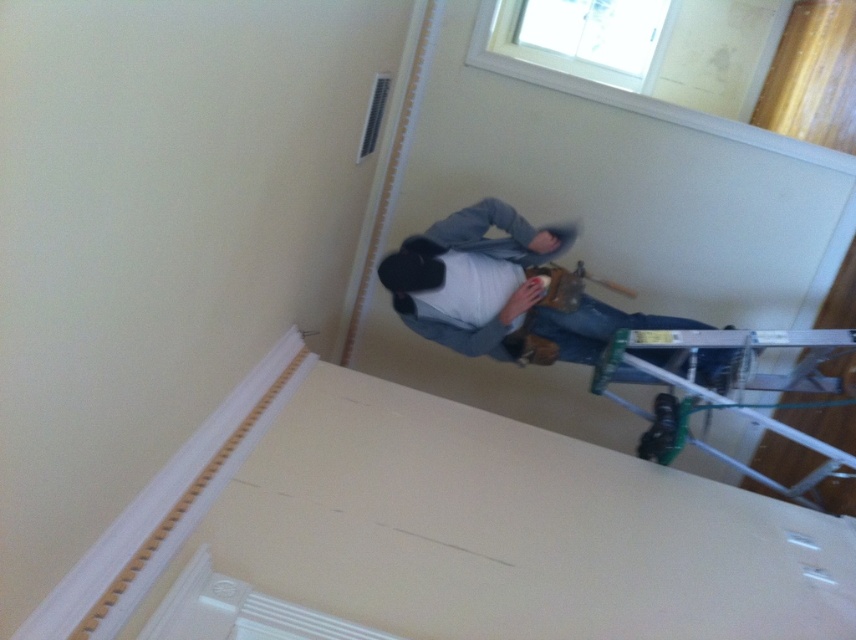
Does denim jacket at upper right appear under metallic silver ladder at lower right?

Actually, denim jacket at upper right is above metallic silver ladder at lower right.

Does denim jacket at upper right have a greater width compared to metallic silver ladder at lower right?

Indeed, denim jacket at upper right has a greater width compared to metallic silver ladder at lower right.

Describe the element at coordinates (502, 291) in the screenshot. This screenshot has width=856, height=640. I see `denim jacket at upper right` at that location.

The image size is (856, 640). Find the location of `denim jacket at upper right`. denim jacket at upper right is located at coordinates (502, 291).